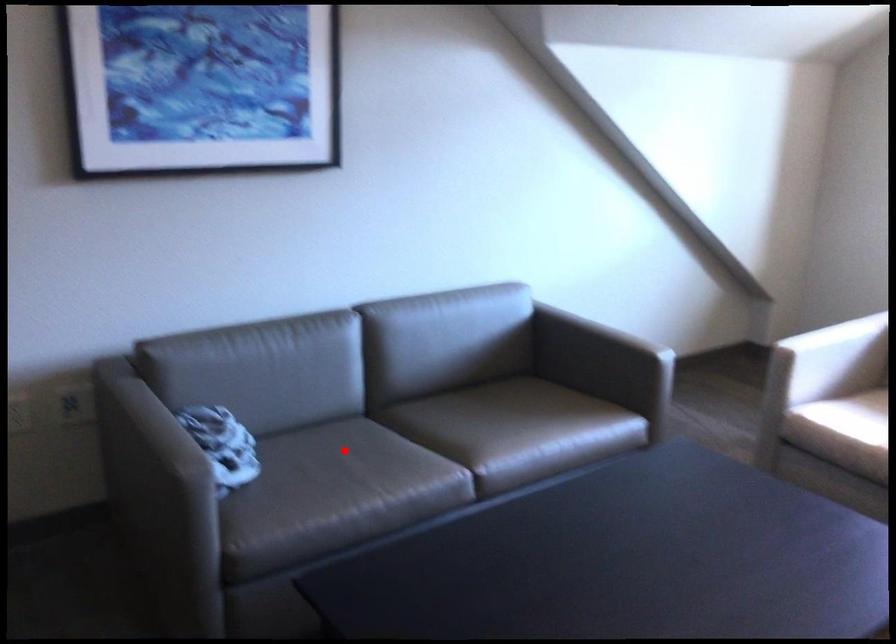
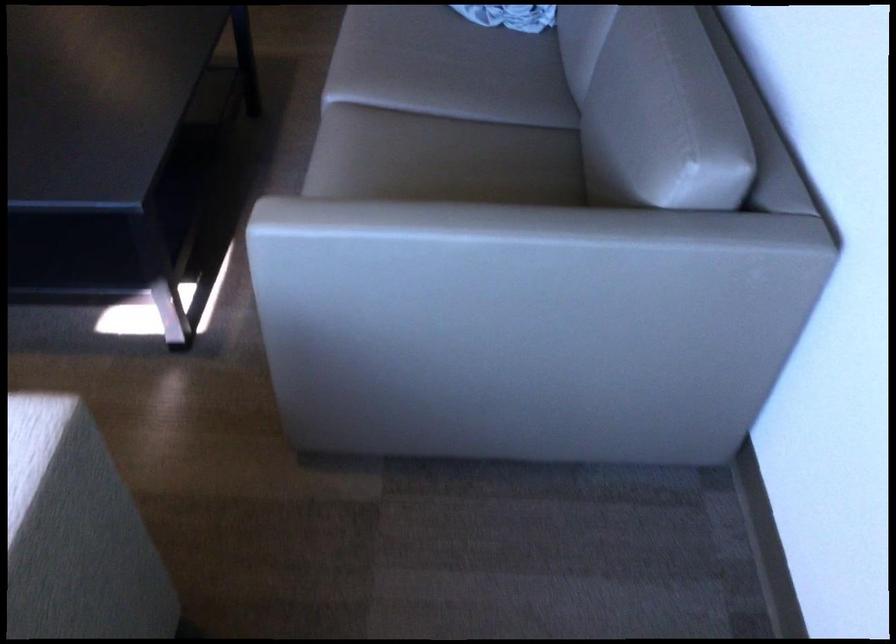
Question: I am providing you with two images of the same scene from different viewpoints. Image1 has a red point marked. In image2, the corresponding 3D location appears at what relative position? Reply with the corresponding letter.

Choices:
 (A) Closer
 (B) Farther

Answer: (A)